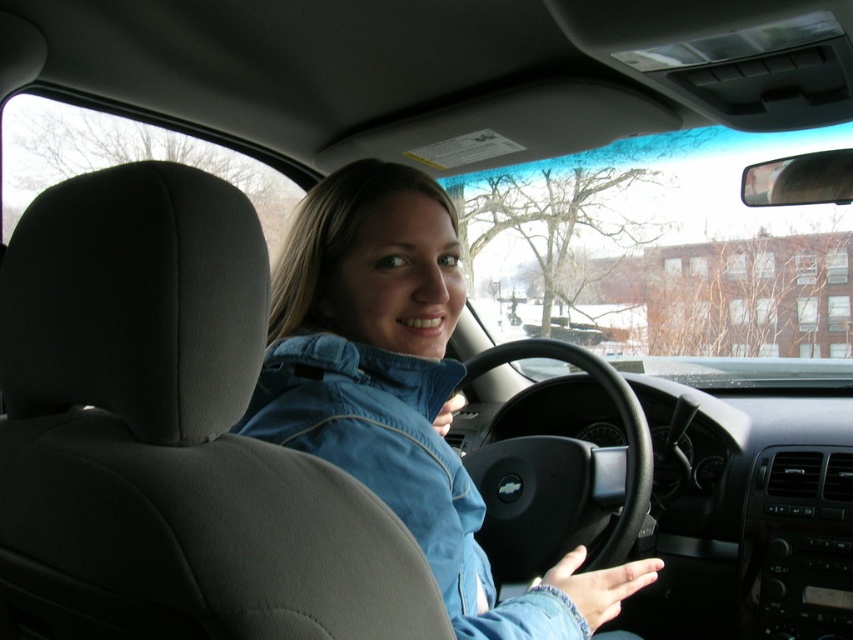
Consider the image. You are a passenger in the car and want to hand the driver a map. The map is in your lap. The driver is wearing the blue denim jacket at upper center. Where should you reach to hand the map to the driver?

You should reach towards the blue denim jacket at upper center to hand the map to the driver.

You are sitting in the passenger seat of the car and want to hand the driver a scarf. The driver is wearing a denim jacket at center. Where should you place the scarf so that it is closest to the black leather steering wheel at center?

Place the scarf to the right of the denim jacket at center, as the denim jacket at center is to the left of the black leather steering wheel at center, so placing it to the right would bring it closer to the steering wheel.

You are a passenger in the car and want to hand a map to the driver wearing the blue denim jacket at upper center. Since the black leather steering wheel at center is in the way, can you reach the driver without moving the steering wheel?

The blue denim jacket at upper center is in front of the black leather steering wheel at center, so the driver is already positioned in front of the steering wheel. You can reach the driver by passing the map over the top of the steering wheel or between the steering wheel and the driver.